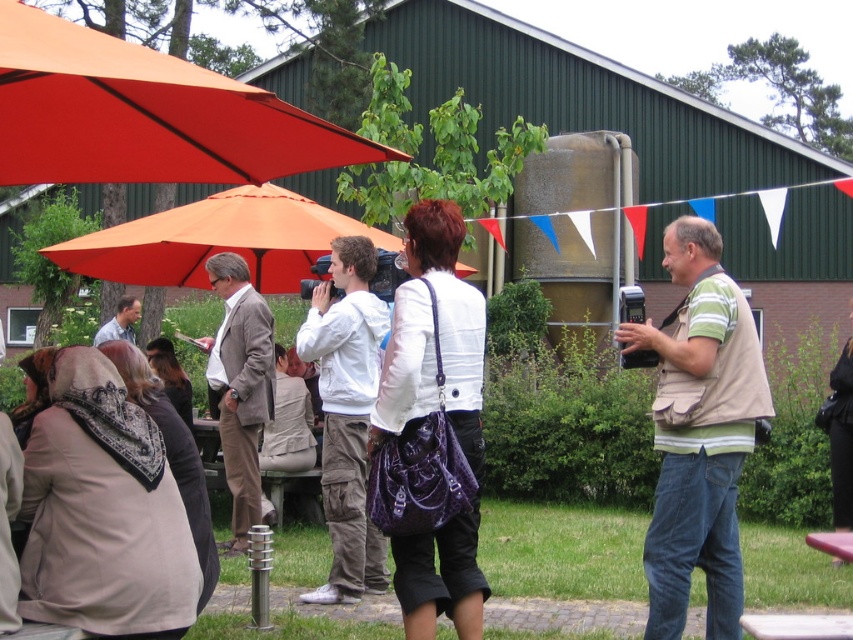
Is orange fabric canopy at upper left shorter than khaki vest at right?

Yes, orange fabric canopy at upper left is shorter than khaki vest at right.

The image size is (853, 640). What do you see at coordinates (144, 115) in the screenshot?
I see `orange fabric canopy at upper left` at bounding box center [144, 115].

Identify the location of orange fabric canopy at upper left. (144, 115).

Is light brown fabric suit at center above wooden picnic table at lower right?

Yes.

Between point (207, 362) and point (817, 545), which one is positioned in front?

Point (817, 545)

Locate an element on the screen. The width and height of the screenshot is (853, 640). light brown fabric suit at center is located at coordinates (241, 387).

I want to click on orange fabric canopy at upper left, so click(x=144, y=115).

Can you confirm if orange fabric canopy at upper left is positioned to the left of light brown fabric suit at center?

In fact, orange fabric canopy at upper left is to the right of light brown fabric suit at center.

Is point (289, 141) less distant than point (260, 316)?

Yes.

Image resolution: width=853 pixels, height=640 pixels. In order to click on orange fabric canopy at upper left in this screenshot , I will do `click(144, 115)`.